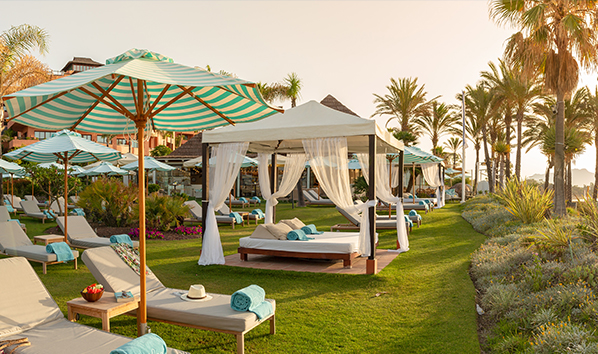
What are the coordinates of `small wooden table` in the screenshot? It's located at (45, 235), (102, 312).